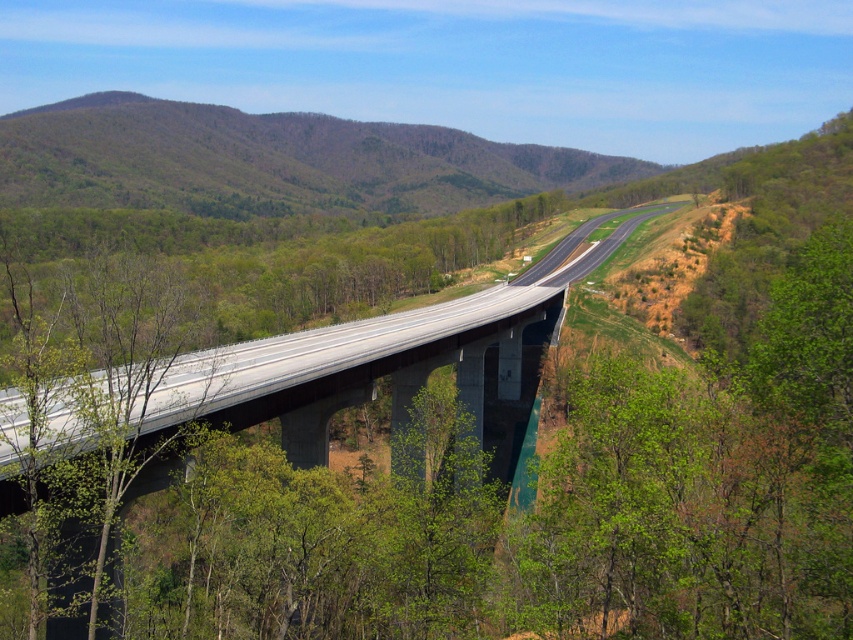
You are a surveyor standing at the camera position and need to mark a point exactly 600 meters away for a new traffic sign. Is the point at point (331, 134) within your target range?

The point at point (331, 134) is 595.87 meters away from the camera, which is within the 600 meter target range. Therefore, the point is suitable for placing the new traffic sign.

You are driving on the highway and see the green leafy forest at upper center and the green leafy tree at center. Which one is closer to your eyes?

The green leafy tree at center is closer to your eyes because the green leafy forest at upper center is further away.

You are a drone operator trying to capture a photo of two specific points on the highway. The first point is labeled as point (235, 131), and the second is point (125, 280). Since you want to ensure both points are clearly visible in the photo, which point should you focus on first to maintain proper focus? Please explain your reasoning based on their positions relative to the camera.

Point (235, 131) is further to the camera than point (125, 280). Therefore, focusing on point (235, 131) first would ensure that both points are within the depth of field, as it is closer to the camera. This way, the focus will naturally extend to the nearer point (125, 280) as well.